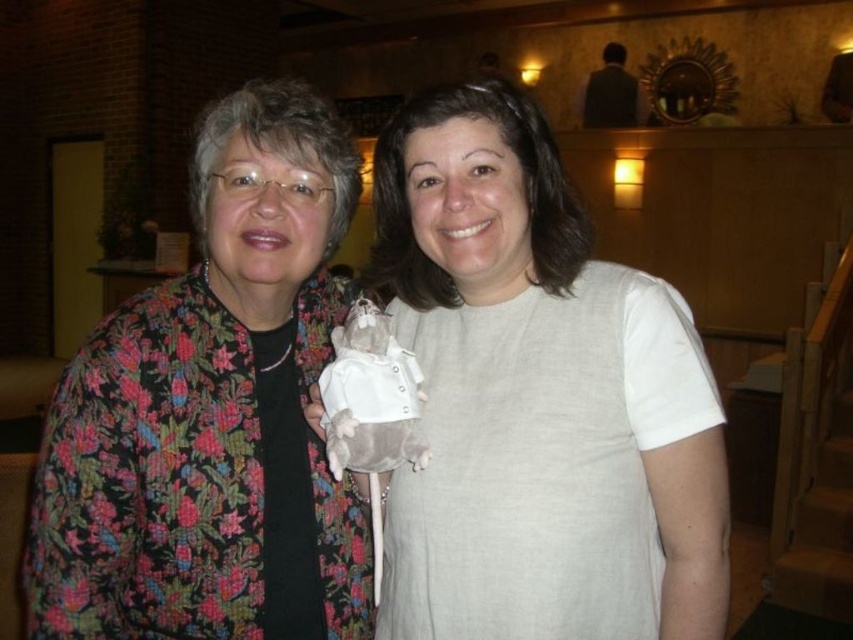
Between point (547, 211) and point (204, 445), which one is positioned in front?

Point (204, 445) is in front.

The width and height of the screenshot is (853, 640). I want to click on white fabric doll at center, so click(537, 397).

Find the location of a particular element. white fabric doll at center is located at coordinates (537, 397).